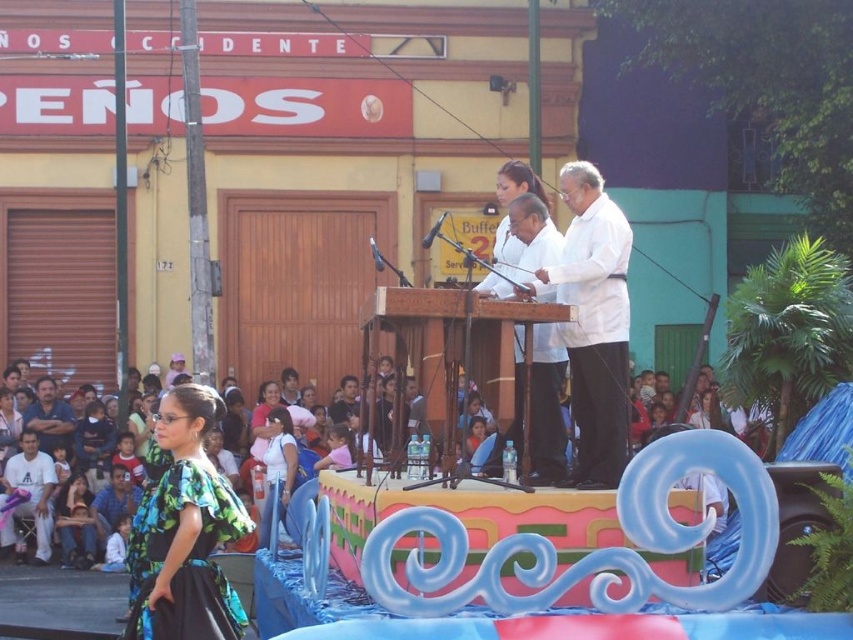
Question: Among these points, which one is nearest to the camera?

Choices:
 (A) (544, 384)
 (B) (65, 428)
 (C) (355, 520)

Answer: (C)

Question: Among these points, which one is nearest to the camera?

Choices:
 (A) (178, 484)
 (B) (265, 451)
 (C) (62, 509)
 (D) (55, 432)

Answer: (A)

Question: Does white matte coat at center have a smaller size compared to matte black clothing at center?

Choices:
 (A) no
 (B) yes

Answer: (A)

Question: Which object is positioned farthest from the white fabric chair at lower left?

Choices:
 (A) dark brown leather jacket at lower left
 (B) matte white blouse at center
 (C) white matte coat at center

Answer: (C)

Question: Does white matte coat at center lie behind matte black clothing at center?

Choices:
 (A) no
 (B) yes

Answer: (B)

Question: Is floral dress at lower left positioned before dark brown leather jacket at lower left?

Choices:
 (A) no
 (B) yes

Answer: (B)